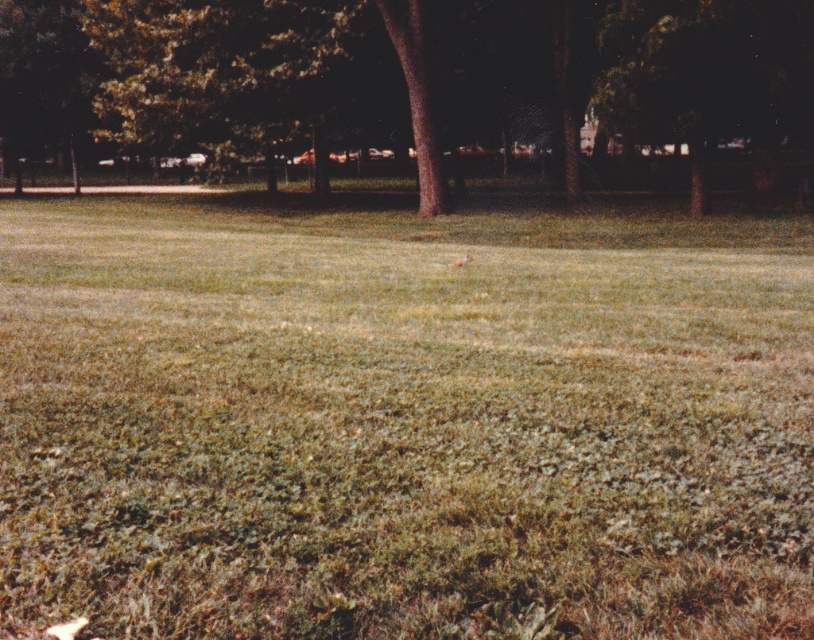
You are standing at the center of the park and want to find the green leafy tree at center. According to the coordinates provided, in which direction should you walk to reach it?

The green leafy tree at center is located at coordinates point (707, 76). Since you are at the center, you should walk towards the lower left direction to reach it.

You are standing in the park and want to reach a specific location marked by the point at coordinates (x=138, y=257). If your walking speed is 1.2 meters per second, how many seconds will it take you to reach that point?

The distance between you and the point at coordinates (x=138, y=257) is 15.63 meters. At a walking speed of 1.2 meters per second, it would take approximately 13.03 seconds to reach the point.

You are standing in the park and want to walk from the point at coordinates [655,51] to the point at coordinates [629,118]. Which direction should you move relative to your current position?

You should move backward because point [655,51] is in front of point [629,118], meaning the destination is behind your starting position.